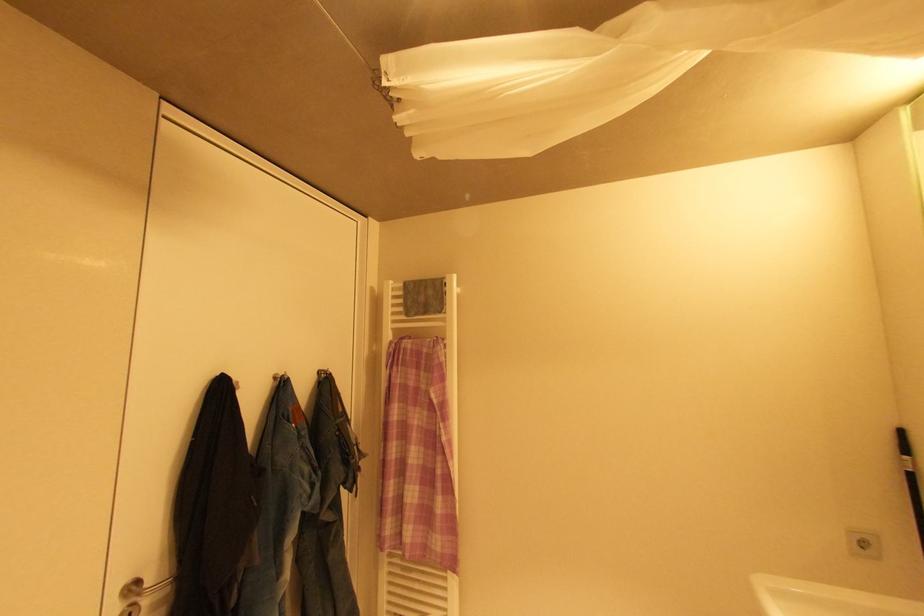
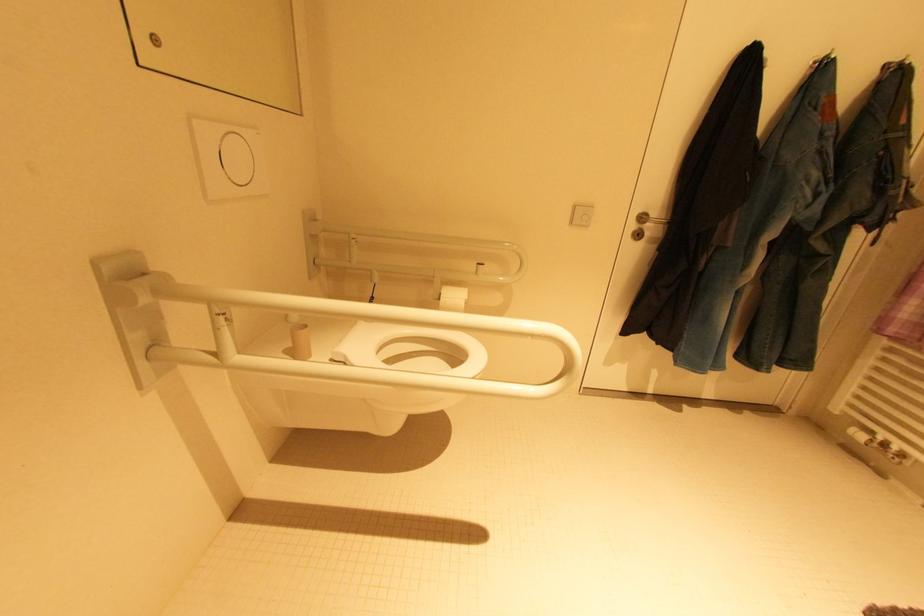
Based on the continuous images, in which direction is the camera rotating?

The camera rotated toward left-down.